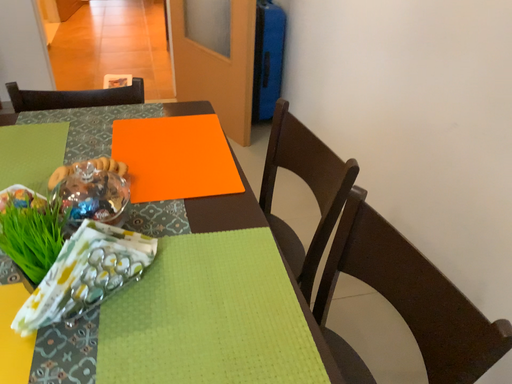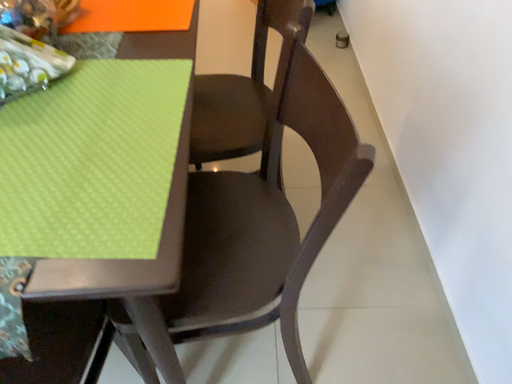
Question: Which way did the camera rotate in the video?

Choices:
 (A) rotated upward
 (B) rotated downward

Answer: (B)